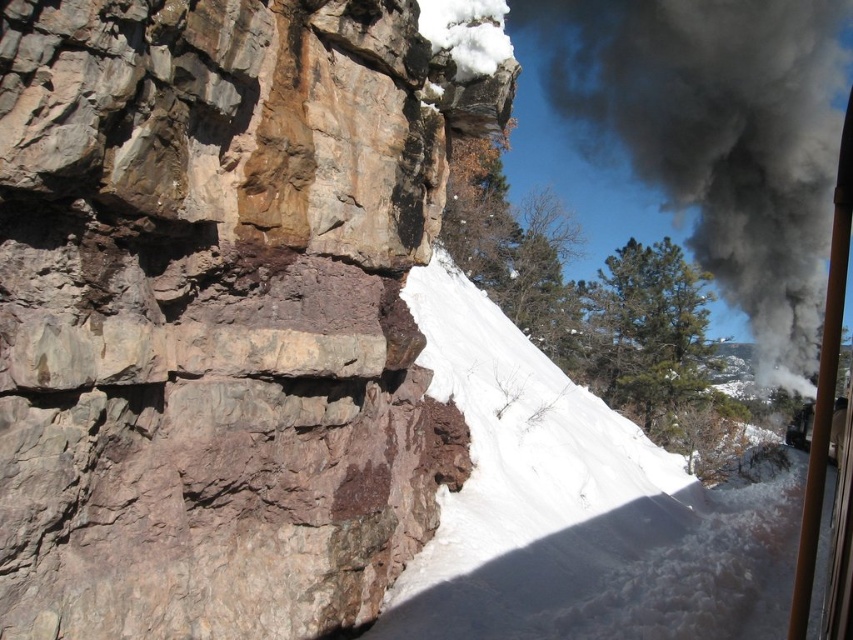
You are standing at the base of the cliff and want to reach the top. You notice two points marked on the image. Which point, point (265, 410) or point (747, 83), is closer to you?

Point (265, 410) is closer to the viewer than point (747, 83).

You are standing at the point marked by the coordinate point at point (218, 310). Looking around, you see the rusty stone cliff at center. What direction is the snow covered incline relative to your current position?

The snow covered incline is to the right of the rusty stone cliff at center, so it is to your right side.